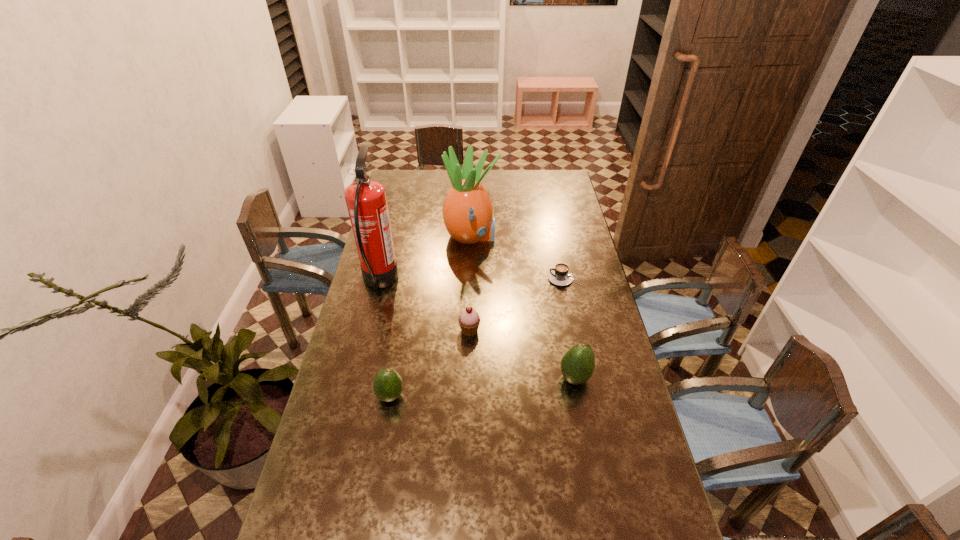
Identify the location of free space between the cappuccino and the right avocado. The height and width of the screenshot is (540, 960). (570, 328).

At what (x,y) coordinates should I click in order to perform the action: click on empty location between the second object from left to right and the cupcake. Please return your answer as a coordinate pair (x, y). The width and height of the screenshot is (960, 540). Looking at the image, I should click on (430, 363).

Find the location of a particular element. free space between the fire extinguisher and the third nearest object is located at coordinates (424, 306).

You are a GUI agent. You are given a task and a screenshot of the screen. Output one action in this format:
    pyautogui.click(x=<x>, y=<y>)
    Task: Click on the vacant space in between the fire extinguisher and the second object from left to right
    Image resolution: width=960 pixels, height=540 pixels.
    Given the screenshot: What is the action you would take?
    pyautogui.click(x=385, y=339)

What are the coordinates of `free area in between the second tallest object and the third tallest object` in the screenshot? It's located at click(523, 307).

This screenshot has height=540, width=960. Find the location of `vacant space that is in between the fire extinguisher and the left avocado`. vacant space that is in between the fire extinguisher and the left avocado is located at coordinates (385, 339).

Identify the location of vacant point located between the farthest object and the leftmost object. This screenshot has height=540, width=960. (425, 259).

Where is `free space between the cupcake and the fire extinguisher`? The height and width of the screenshot is (540, 960). free space between the cupcake and the fire extinguisher is located at coordinates (424, 306).

Locate which object ranks fifth in proximity to the leftmost object. Please provide its 2D coordinates. Your answer should be formatted as a tuple, i.e. [(x, y)], where the tuple contains the x and y coordinates of a point satisfying the conditions above.

[(577, 364)]

Identify the location of the closest object to the taller avocado. (469, 320).